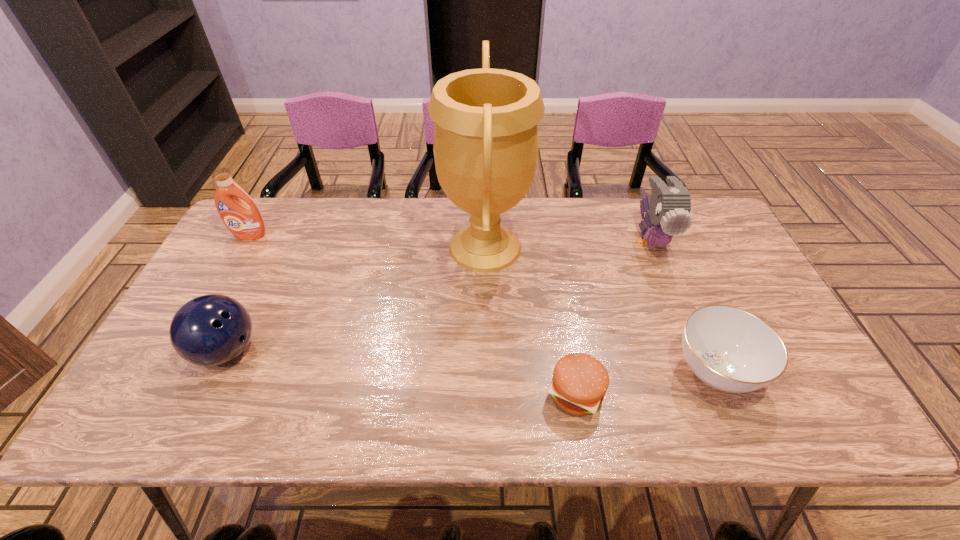
Select which object is the third closest to the trophy. Please provide its 2D coordinates. Your answer should be formatted as a tuple, i.e. [(x, y)], where the tuple contains the x and y coordinates of a point satisfying the conditions above.

[(668, 209)]

Choose which object is the fifth nearest neighbor to the detergent. Please provide its 2D coordinates. Your answer should be formatted as a tuple, i.e. [(x, y)], where the tuple contains the x and y coordinates of a point satisfying the conditions above.

[(729, 349)]

This screenshot has height=540, width=960. Find the location of `free space that satisfies the following two spatial constraints: 1. on the surface of the chinaware near the finger holes; 2. on the left side of the fourth tallest object`. free space that satisfies the following two spatial constraints: 1. on the surface of the chinaware near the finger holes; 2. on the left side of the fourth tallest object is located at coordinates (217, 370).

Locate an element on the screen. The width and height of the screenshot is (960, 540). free location that satisfies the following two spatial constraints: 1. at the beak of the bird; 2. on the engravings side of the tallest object is located at coordinates (654, 247).

Locate an element on the screen. vacant region that satisfies the following two spatial constraints: 1. on the surface of the hamburger near the finger holes; 2. on the left side of the bowling ball is located at coordinates (206, 393).

Find the location of a particular element. Image resolution: width=960 pixels, height=540 pixels. vacant space that satisfies the following two spatial constraints: 1. on the surface of the hamburger near the finger holes; 2. on the right side of the third shortest object is located at coordinates (206, 393).

Find the location of a particular element. free space that satisfies the following two spatial constraints: 1. at the beak of the bird; 2. on the surface of the bowling ball near the finger holes is located at coordinates (696, 350).

The width and height of the screenshot is (960, 540). I want to click on free location that satisfies the following two spatial constraints: 1. at the beak of the bird; 2. on the surface of the bowling ball near the finger holes, so click(x=696, y=350).

Find the location of a particular element. The width and height of the screenshot is (960, 540). free location that satisfies the following two spatial constraints: 1. at the beak of the bird; 2. on the engravings side of the tallest object is located at coordinates (654, 247).

Image resolution: width=960 pixels, height=540 pixels. Find the location of `vacant space that satisfies the following two spatial constraints: 1. at the beak of the bird; 2. on the surface of the bowling ball near the finger holes`. vacant space that satisfies the following two spatial constraints: 1. at the beak of the bird; 2. on the surface of the bowling ball near the finger holes is located at coordinates (696, 350).